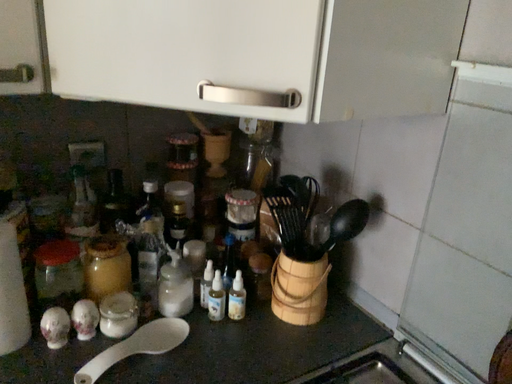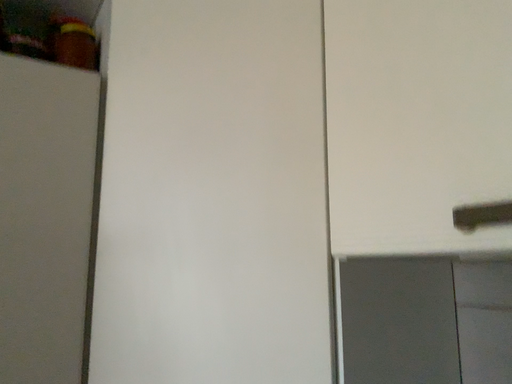
Question: Which way did the camera rotate in the video?

Choices:
 (A) rotated downward
 (B) rotated upward

Answer: (B)